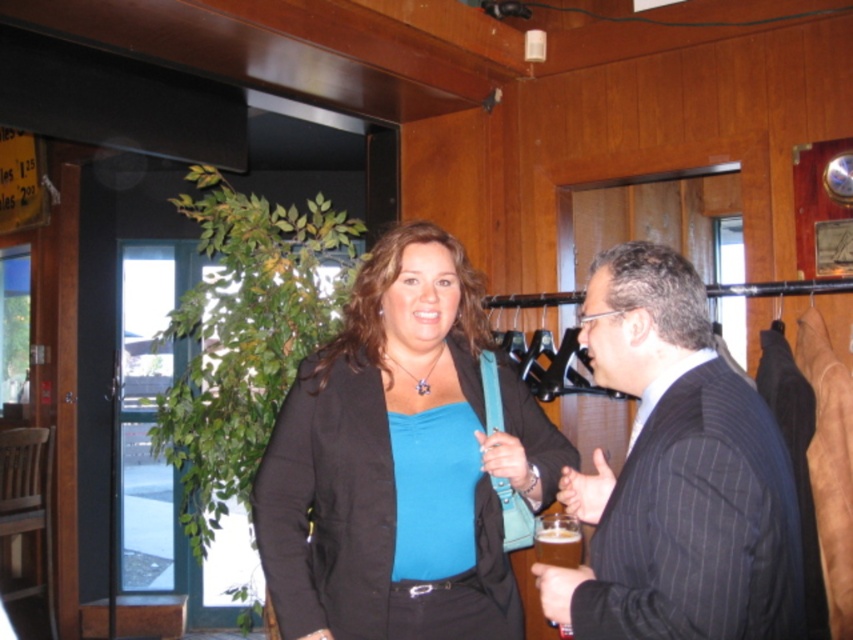
Consider the image. Is matte black blazer at center shorter than black pinstripe suit at center?

In fact, matte black blazer at center may be taller than black pinstripe suit at center.

Does matte black blazer at center lie in front of black pinstripe suit at center?

No, it is behind black pinstripe suit at center.

Between point (357, 570) and point (560, 582), which one is positioned in front?

Point (560, 582) is in front.

Find the location of a particular element. matte black blazer at center is located at coordinates (399, 461).